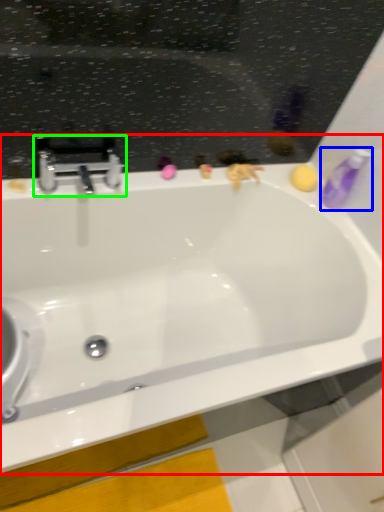
Question: Based on their relative distances, which object is farther from bathtub (highlighted by a red box)? Choose from toiletry (highlighted by a blue box) and tap (highlighted by a green box).

Choices:
 (A) toiletry
 (B) tap

Answer: (A)